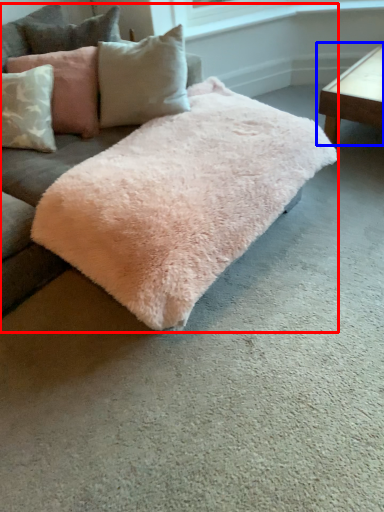
Question: Among these objects, which one is farthest to the camera, studio couch (highlighted by a red box) or table (highlighted by a blue box)?

Choices:
 (A) studio couch
 (B) table

Answer: (B)